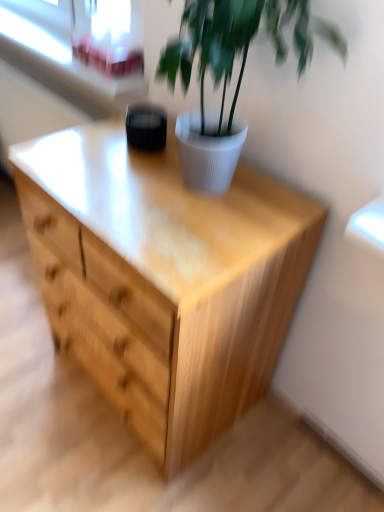
This screenshot has height=512, width=384. I want to click on free space in front of natural wood chest of drawers at center, so click(x=125, y=474).